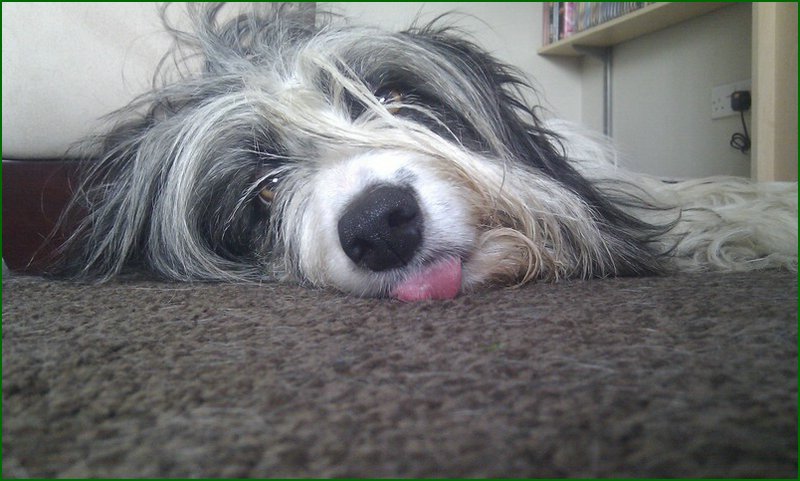
Identify the location of shelf. (613, 35).